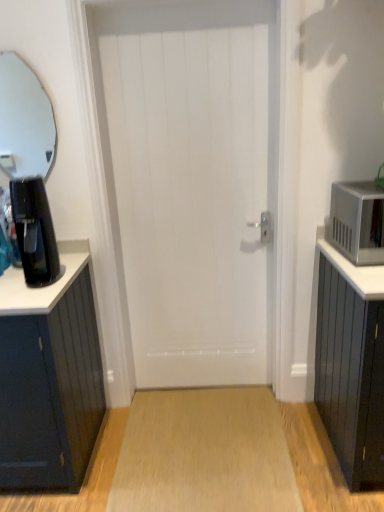
Where is `free spot above light brown wood floor at center (from a real-world perspective)`? The width and height of the screenshot is (384, 512). free spot above light brown wood floor at center (from a real-world perspective) is located at coordinates (210, 435).